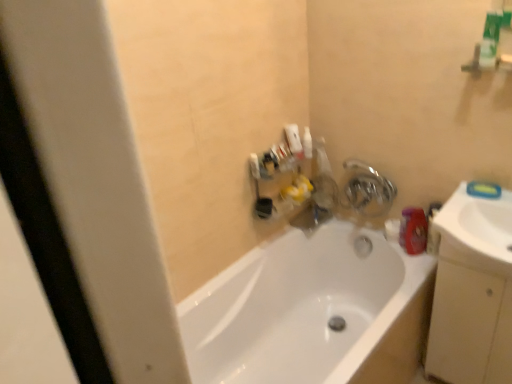
Question: Is white glossy sink at right in front of or behind matte plastic faucet at upper center in the image?

Choices:
 (A) behind
 (B) front

Answer: (B)

Question: In terms of size, does white glossy sink at right appear bigger or smaller than matte plastic faucet at upper center?

Choices:
 (A) big
 (B) small

Answer: (A)

Question: Which object is the closest to the metallic silver faucet at upper right?

Choices:
 (A) white glossy bathtub at center
 (B) white glossy sink at right
 (C) beige matte cabinet at right
 (D) matte plastic faucet at upper center

Answer: (D)

Question: Estimate the real-world distances between objects in this image. Which object is farther from the beige matte cabinet at right?

Choices:
 (A) metallic silver faucet at upper right
 (B) white glossy bathtub at center
 (C) matte plastic faucet at upper center
 (D) white glossy sink at right

Answer: (C)